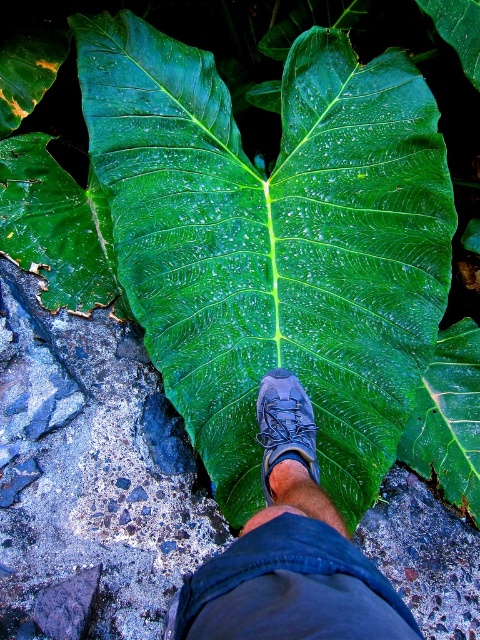
Question: Estimate the real-world distances between objects in this image. Which object is closer to the dark gray leather shoe at center?

Choices:
 (A) green glossy leaf at center
 (B) matte blue shoe at center

Answer: (B)

Question: Among these points, which one is nearest to the camera?

Choices:
 (A) (274, 372)
 (B) (300, 390)

Answer: (B)

Question: Does dark gray leather shoe at center appear on the left side of matte blue shoe at center?

Choices:
 (A) no
 (B) yes

Answer: (B)

Question: Is green glossy leaf at center bigger than matte blue shoe at center?

Choices:
 (A) no
 (B) yes

Answer: (B)

Question: Is green glossy leaf at center below dark gray leather shoe at center?

Choices:
 (A) yes
 (B) no

Answer: (B)

Question: Estimate the real-world distances between objects in this image. Which object is farther from the matte blue shoe at center?

Choices:
 (A) green glossy leaf at center
 (B) dark gray leather shoe at center

Answer: (A)